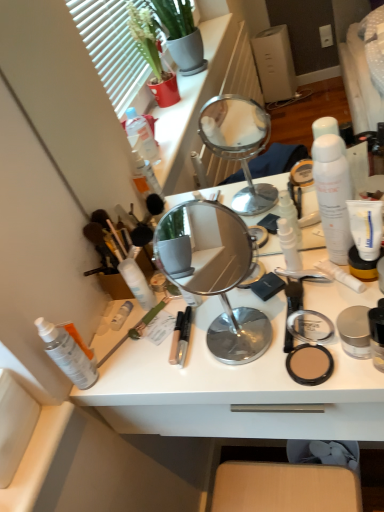
Locate an element on the screen. empty space that is in between polished silver mirror at center and white matte lotion at center, the 5th toiletry when ordered from left to right is located at coordinates (259, 296).